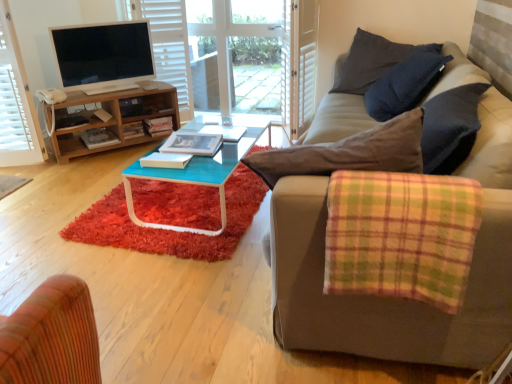
Question: Is dark gray cotton pillow at upper right smaller than shaggy red rug at center?

Choices:
 (A) no
 (B) yes

Answer: (A)

Question: Considering the relative positions of dark gray cotton pillow at upper right and shaggy red rug at center in the image provided, is dark gray cotton pillow at upper right behind shaggy red rug at center?

Choices:
 (A) no
 (B) yes

Answer: (B)

Question: Does dark gray cotton pillow at upper right have a lesser height compared to shaggy red rug at center?

Choices:
 (A) yes
 (B) no

Answer: (B)

Question: From the image's perspective, does dark gray cotton pillow at upper right appear higher than shaggy red rug at center?

Choices:
 (A) yes
 (B) no

Answer: (A)

Question: Is dark gray cotton pillow at upper right in contact with shaggy red rug at center?

Choices:
 (A) no
 (B) yes

Answer: (A)

Question: Is white plastic phone at left taller or shorter than white sheer curtain at upper left?

Choices:
 (A) tall
 (B) short

Answer: (B)

Question: Considering their positions, is white plastic phone at left located in front of or behind white sheer curtain at upper left?

Choices:
 (A) front
 (B) behind

Answer: (B)

Question: In terms of width, does white plastic phone at left look wider or thinner when compared to white sheer curtain at upper left?

Choices:
 (A) thin
 (B) wide

Answer: (A)

Question: Choose the correct answer: Is white plastic phone at left inside white sheer curtain at upper left or outside it?

Choices:
 (A) inside
 (B) outside

Answer: (B)

Question: Would you say shaggy red rug at center is to the left or to the right of dark gray cotton pillow at upper right in the picture?

Choices:
 (A) right
 (B) left

Answer: (B)

Question: In terms of size, does shaggy red rug at center appear bigger or smaller than dark gray cotton pillow at upper right?

Choices:
 (A) big
 (B) small

Answer: (B)

Question: From the image's perspective, relative to dark gray cotton pillow at upper right, is shaggy red rug at center above or below?

Choices:
 (A) above
 (B) below

Answer: (B)

Question: From their relative heights in the image, would you say shaggy red rug at center is taller or shorter than dark gray cotton pillow at upper right?

Choices:
 (A) tall
 (B) short

Answer: (B)

Question: From the image's perspective, is matte black tv at upper left positioned above or below dark gray cotton pillow at upper right?

Choices:
 (A) above
 (B) below

Answer: (A)

Question: Looking at their shapes, would you say matte black tv at upper left is wider or thinner than dark gray cotton pillow at upper right?

Choices:
 (A) thin
 (B) wide

Answer: (A)